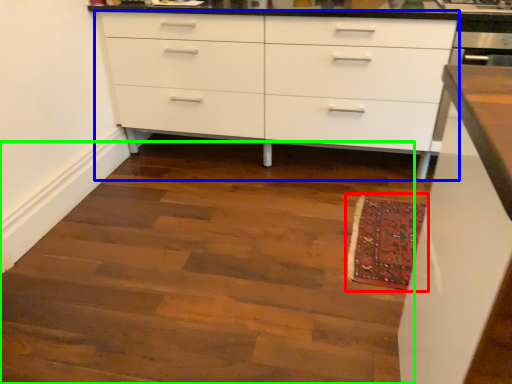
Question: Estimate the real-world distances between objects in this image. Which object is farther from mat (highlighted by a red box), chest of drawers (highlighted by a blue box) or stairwell (highlighted by a green box)?

Choices:
 (A) chest of drawers
 (B) stairwell

Answer: (A)